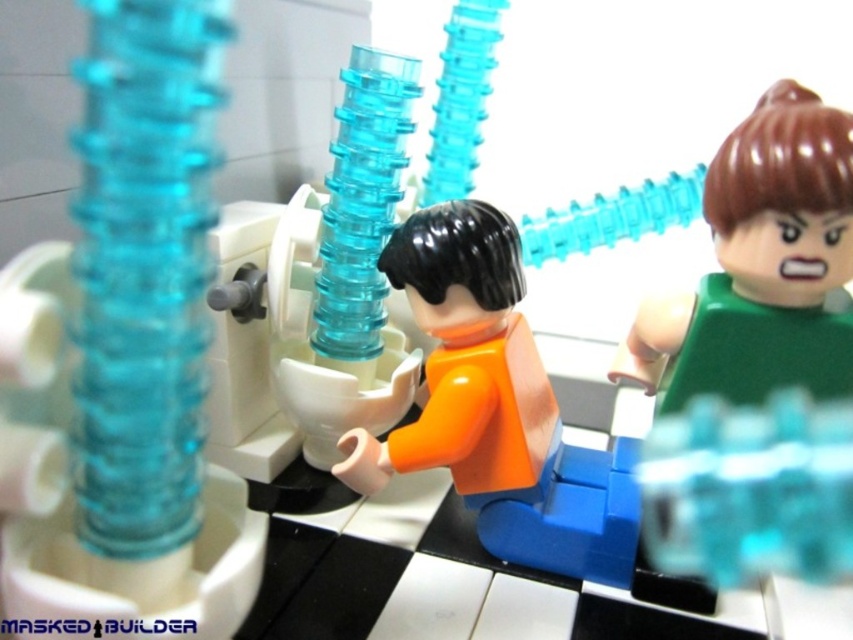
In the scene shown: You are a LEGO builder examining the bathroom scene. You notice the transparent blue tube at center and the orange matte figure at center. Which object is positioned closer to you?

The transparent blue tube at center is closer to the viewer than the orange matte figure at center.